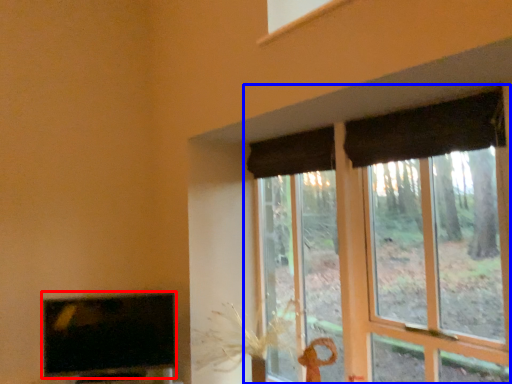
Question: Which of the following is the farthest to the observer, television (highlighted by a red box) or window (highlighted by a blue box)?

Choices:
 (A) television
 (B) window

Answer: (A)